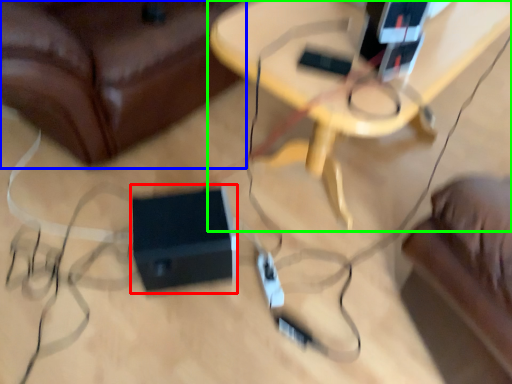
Question: Which object is the farthest from speaker (highlighted by a red box)? Choose among these: furniture (highlighted by a blue box) or table (highlighted by a green box).

Choices:
 (A) furniture
 (B) table

Answer: (B)